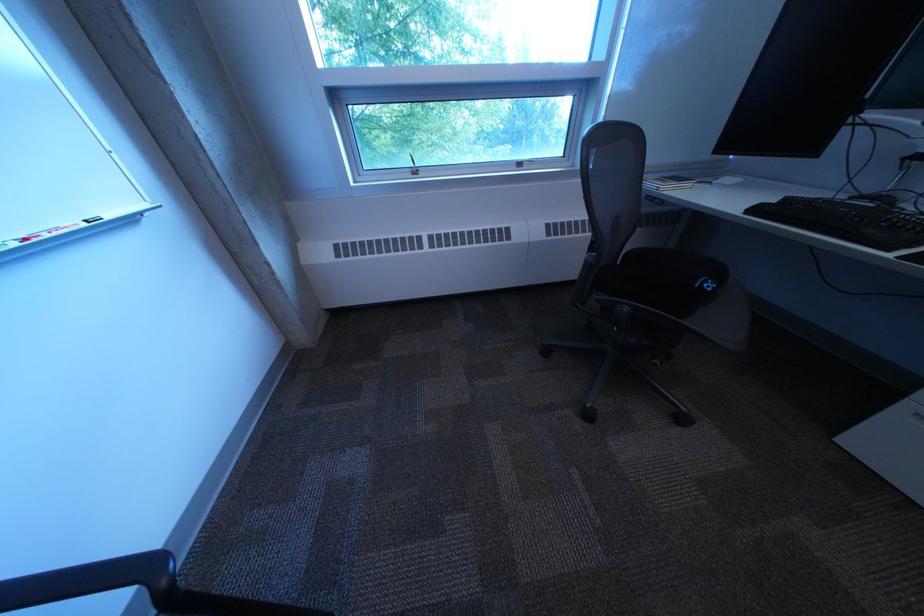
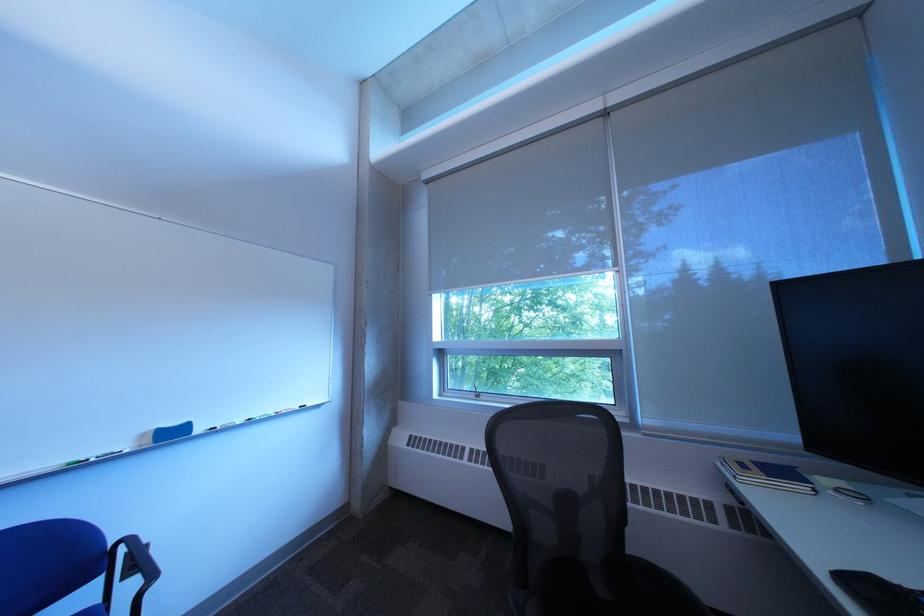
The images are taken continuously from a first-person perspective. In which direction is your viewpoint rotating?

The camera's rotation is toward left-up.